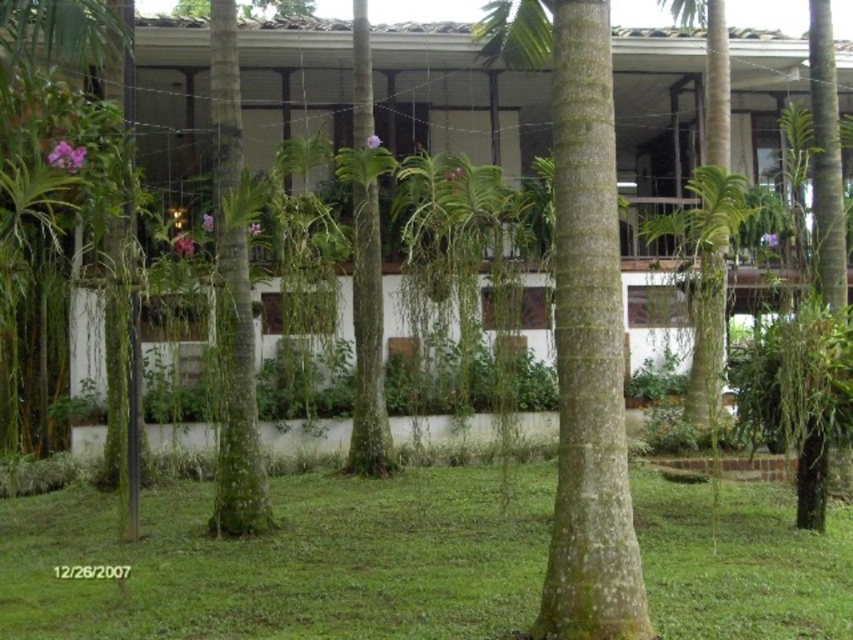
You are standing in front of the two green trees at the center of the scene. Which tree is closer to you, the green textured tree at center or the green leafy tree at center?

The green textured tree at center is positioned over the green leafy tree at center, meaning the green textured tree at center is closer to you.

From the picture: You are standing in the outdoor scene and want to walk from point A to point B. The coordinates of point A are point (827, 625) and point B are point (357, 273). Considering the building and palm trees in the scene, which direction should you move to go from point A to point B?

To move from point A to point B, you should move towards the direction where point B is located, which is behind point A since point A is in front of point B according to their coordinates. Since point A is in front of point B, you need to move backward or towards the background of the scene to reach point B.